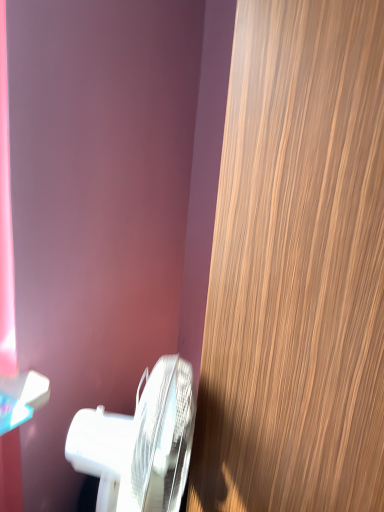
Question: Based on their sizes in the image, would you say wooden door at right is bigger or smaller than white glossy toilet at lower left?

Choices:
 (A) big
 (B) small

Answer: (A)

Question: Is wooden door at right taller or shorter than white glossy toilet at lower left?

Choices:
 (A) tall
 (B) short

Answer: (A)

Question: From a real-world perspective, is wooden door at right physically located above or below white glossy toilet at lower left?

Choices:
 (A) above
 (B) below

Answer: (A)

Question: Based on their positions, is white glossy toilet at lower left located to the left or right of wooden door at right?

Choices:
 (A) right
 (B) left

Answer: (B)

Question: Is white glossy toilet at lower left taller or shorter than wooden door at right?

Choices:
 (A) tall
 (B) short

Answer: (B)

Question: From a real-world perspective, is white glossy toilet at lower left above or below wooden door at right?

Choices:
 (A) below
 (B) above

Answer: (A)

Question: From the image's perspective, is white glossy toilet at lower left positioned above or below wooden door at right?

Choices:
 (A) above
 (B) below

Answer: (B)